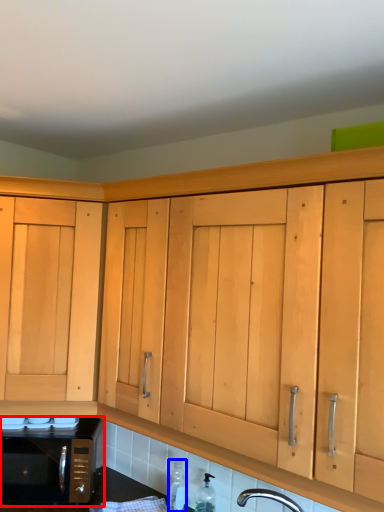
Question: Which point is closer to the camera, microwave oven (highlighted by a red box) or bottle (highlighted by a blue box)?

Choices:
 (A) microwave oven
 (B) bottle

Answer: (B)